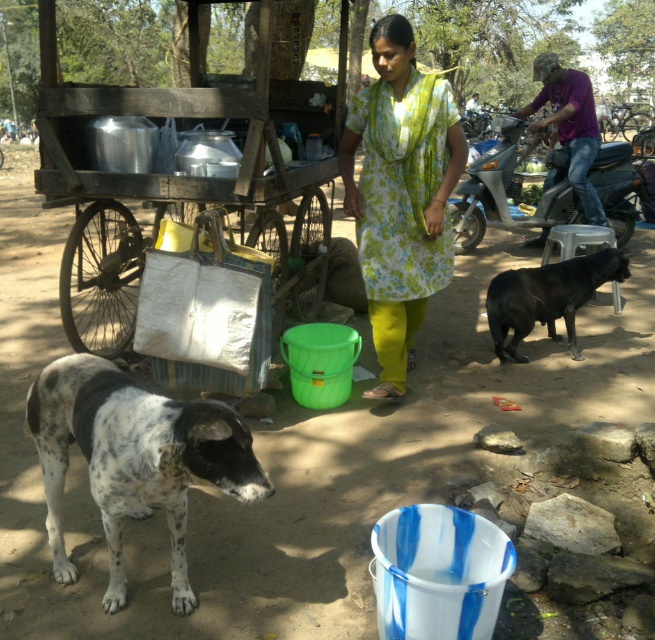
Question: Which point appears farthest from the camera in this image?

Choices:
 (A) (393, 179)
 (B) (582, 134)

Answer: (B)

Question: Which point appears closest to the camera in this image?

Choices:
 (A) (77, 129)
 (B) (569, 97)
 (C) (574, 273)

Answer: (A)

Question: Which of the following is the closest to the observer?

Choices:
 (A) 624,204
 (B) 434,236
 (C) 544,88
 (D) 58,406

Answer: (D)

Question: Is the position of metallic silver motorcycle at right more distant than that of light green floral dress at center?

Choices:
 (A) no
 (B) yes

Answer: (A)

Question: Is black smooth dog at right above light green floral dress at center?

Choices:
 (A) no
 (B) yes

Answer: (A)

Question: Is brushed metal cart at center above light green floral dress at center?

Choices:
 (A) no
 (B) yes

Answer: (A)